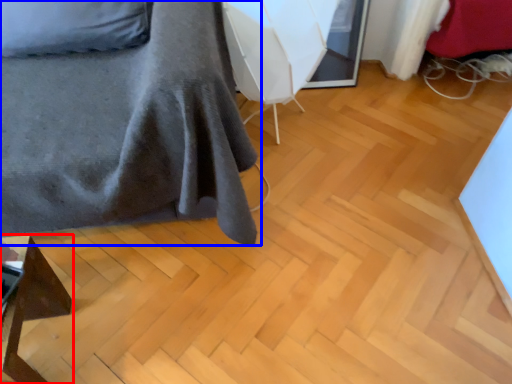
Question: Which point is closer to the camera, furniture (highlighted by a red box) or furniture (highlighted by a blue box)?

Choices:
 (A) furniture
 (B) furniture

Answer: (B)